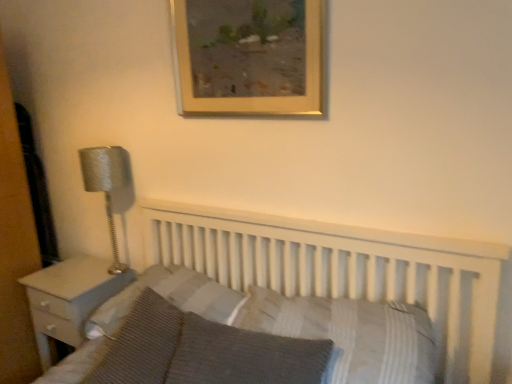
Question: From the image's perspective, is gold wooden picture frame at upper center on white textured pillow at center, positioned as the 4th pillow in left-to-right order?

Choices:
 (A) yes
 (B) no

Answer: (A)

Question: Is gold wooden picture frame at upper center wider than white textured pillow at center, positioned as the 4th pillow in left-to-right order?

Choices:
 (A) no
 (B) yes

Answer: (A)

Question: Considering the relative sizes of gold wooden picture frame at upper center and white textured pillow at center, positioned as the 4th pillow in left-to-right order, in the image provided, is gold wooden picture frame at upper center smaller than white textured pillow at center, positioned as the 4th pillow in left-to-right order,?

Choices:
 (A) no
 (B) yes

Answer: (B)

Question: Does gold wooden picture frame at upper center have a lesser height compared to white textured pillow at center, which appears as the 1th pillow when viewed from the right?

Choices:
 (A) no
 (B) yes

Answer: (A)

Question: From a real-world perspective, is gold wooden picture frame at upper center on white textured pillow at center, which appears as the 1th pillow when viewed from the right?

Choices:
 (A) yes
 (B) no

Answer: (A)

Question: Is gold wooden picture frame at upper center far away from white textured pillow at center, positioned as the 4th pillow in left-to-right order?

Choices:
 (A) yes
 (B) no

Answer: (B)

Question: From a real-world perspective, is striped fabric pillow at center, the second pillow from the left, below knitted fabric pillow at lower left, acting as the first pillow starting from the left?

Choices:
 (A) no
 (B) yes

Answer: (A)

Question: Can we say striped fabric pillow at center, the second pillow from the left, lies outside knitted fabric pillow at lower left, acting as the first pillow starting from the left?

Choices:
 (A) no
 (B) yes

Answer: (B)

Question: From the image's perspective, is striped fabric pillow at center, which ranks as the 3th pillow in right-to-left order, above knitted fabric pillow at lower left, marked as the fourth pillow in a right-to-left arrangement?

Choices:
 (A) no
 (B) yes

Answer: (B)

Question: Could you tell me if striped fabric pillow at center, which ranks as the 3th pillow in right-to-left order, is facing knitted fabric pillow at lower left, marked as the fourth pillow in a right-to-left arrangement?

Choices:
 (A) yes
 (B) no

Answer: (A)

Question: Does striped fabric pillow at center, which ranks as the 3th pillow in right-to-left order, lie in front of knitted fabric pillow at lower left, marked as the fourth pillow in a right-to-left arrangement?

Choices:
 (A) no
 (B) yes

Answer: (A)

Question: Is the depth of striped fabric pillow at center, the second pillow from the left, greater than that of knitted fabric pillow at lower left, acting as the first pillow starting from the left?

Choices:
 (A) yes
 (B) no

Answer: (A)

Question: Is the depth of white wood nightstand at left greater than that of silver textured lamp at left?

Choices:
 (A) yes
 (B) no

Answer: (A)